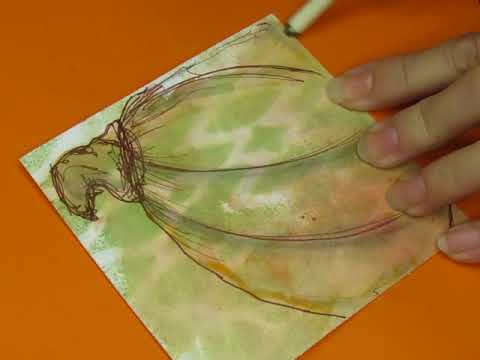
The height and width of the screenshot is (360, 480). What are the coordinates of `writing utensil` in the screenshot? It's located at (307, 11).